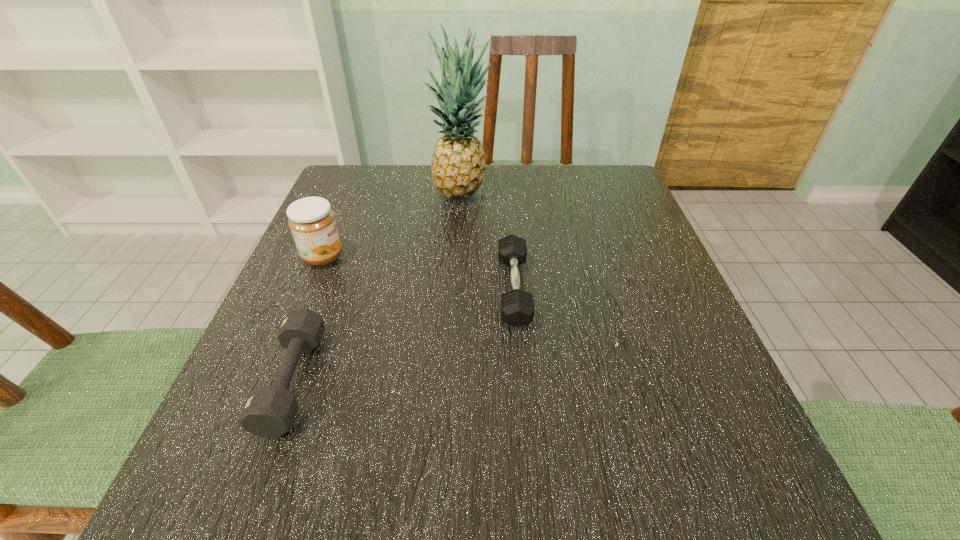
Locate an element on the screen. The height and width of the screenshot is (540, 960). free location located on the back of the right dumbbell is located at coordinates (509, 225).

Identify the location of object that is positioned at the far edge. The height and width of the screenshot is (540, 960). (458, 162).

What are the coordinates of `jam located at the left edge` in the screenshot? It's located at (312, 222).

Locate an element on the screen. Image resolution: width=960 pixels, height=540 pixels. dumbbell that is at the left edge is located at coordinates (270, 411).

In the image, there is a desktop. Where is `free space at the far edge`? free space at the far edge is located at coordinates (502, 165).

Identify the location of vacant space at the near edge of the desktop. (428, 474).

This screenshot has width=960, height=540. In the image, there is a desktop. In order to click on vacant space at the left edge in this screenshot , I will do `click(370, 220)`.

In the image, there is a desktop. At what (x,y) coordinates should I click in order to perform the action: click on free space at the right edge. Please return your answer as a coordinate pair (x, y). The width and height of the screenshot is (960, 540). Looking at the image, I should click on (606, 310).

The height and width of the screenshot is (540, 960). Find the location of `vacant space at the far left corner`. vacant space at the far left corner is located at coordinates (331, 192).

I want to click on vacant space at the near left corner of the desktop, so click(281, 489).